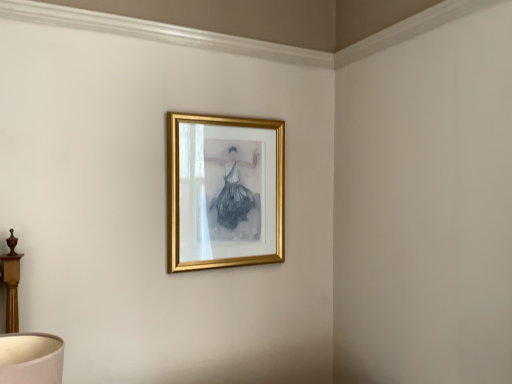
Question: Which direction should I rotate to look at gold metallic picture frame at upper center?

Choices:
 (A) right
 (B) left

Answer: (B)